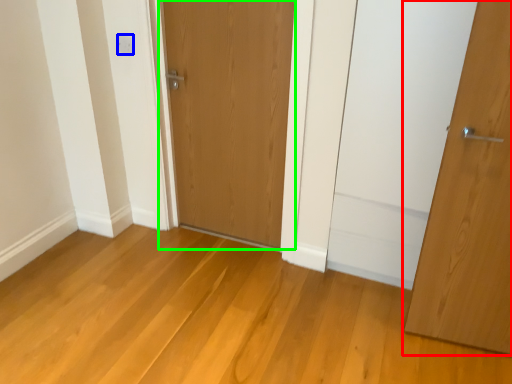
Question: Considering the real-world distances, which object is closest to door (highlighted by a red box)? electric outlet (highlighted by a blue box) or door (highlighted by a green box).

Choices:
 (A) electric outlet
 (B) door

Answer: (B)